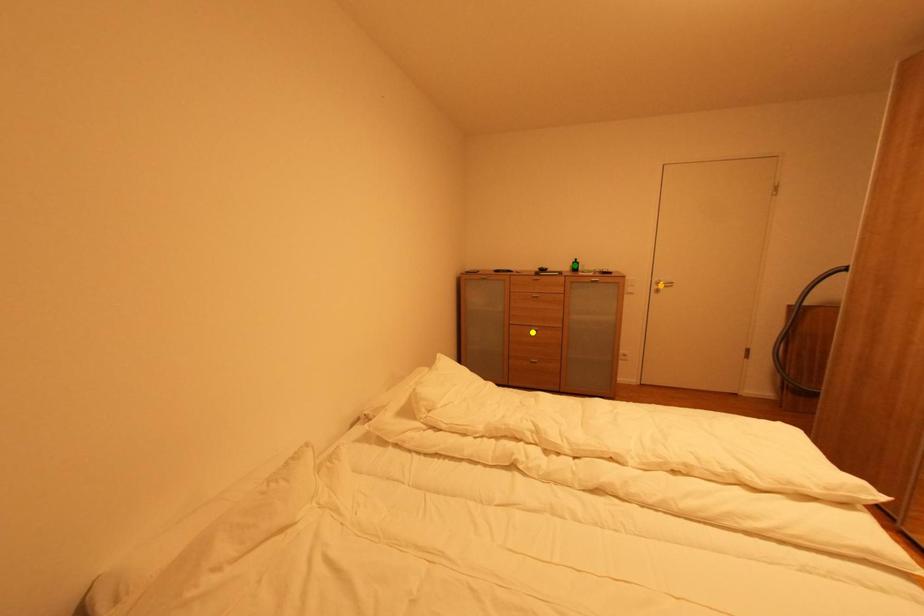
Order these from nearest to farthest:
green point
orange point
yellow point

orange point, yellow point, green point